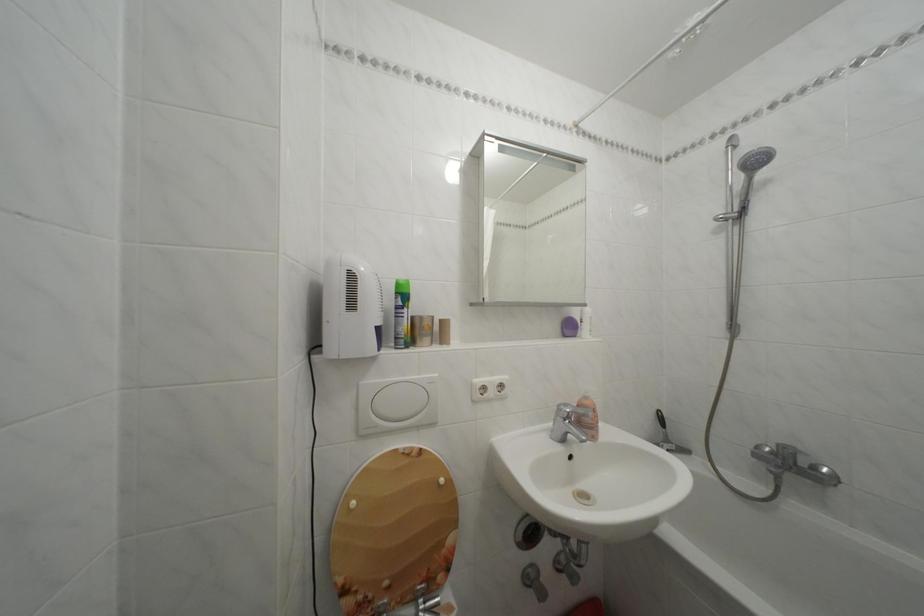
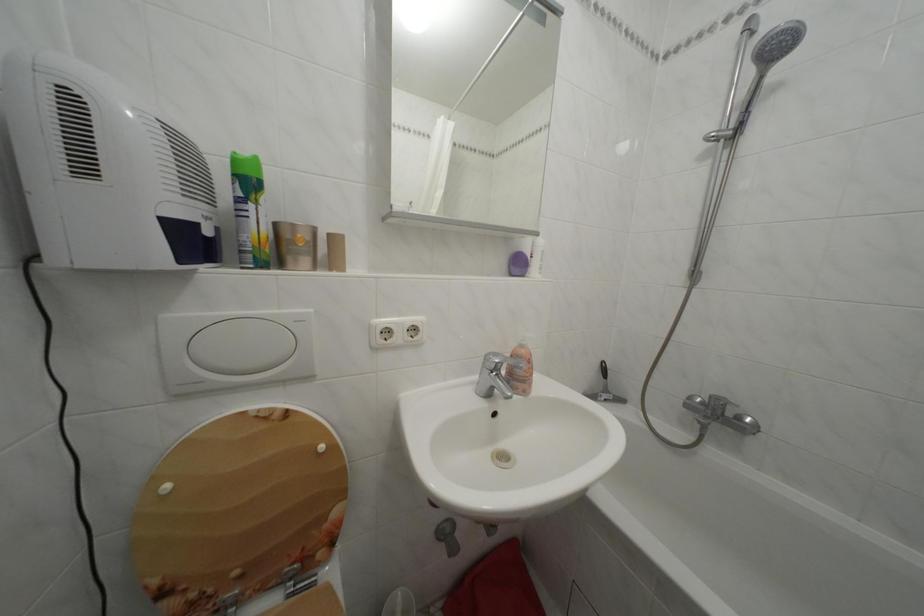
Find the pixel in the second image that matches (x=567, y=411) in the first image.

(495, 362)